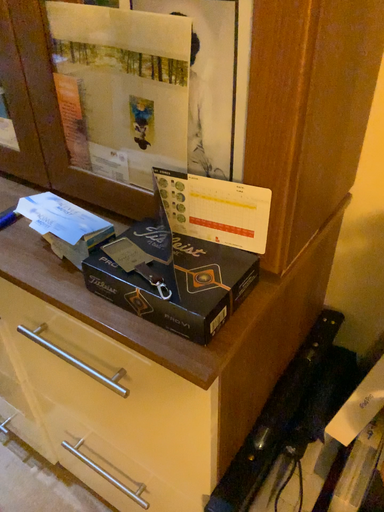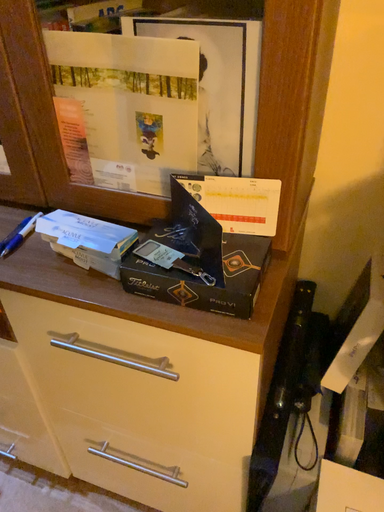
Question: Which way did the camera rotate in the video?

Choices:
 (A) rotated left
 (B) rotated right

Answer: (B)